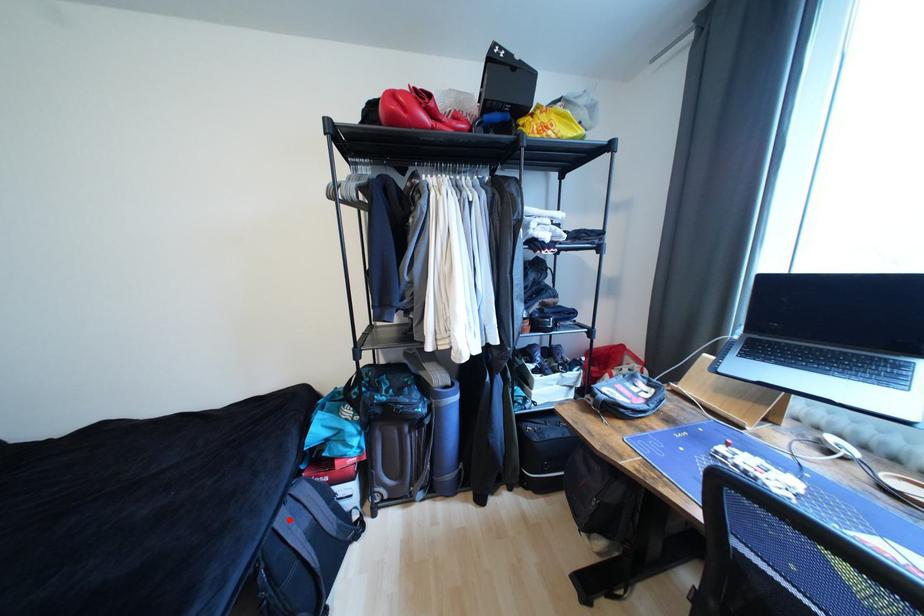
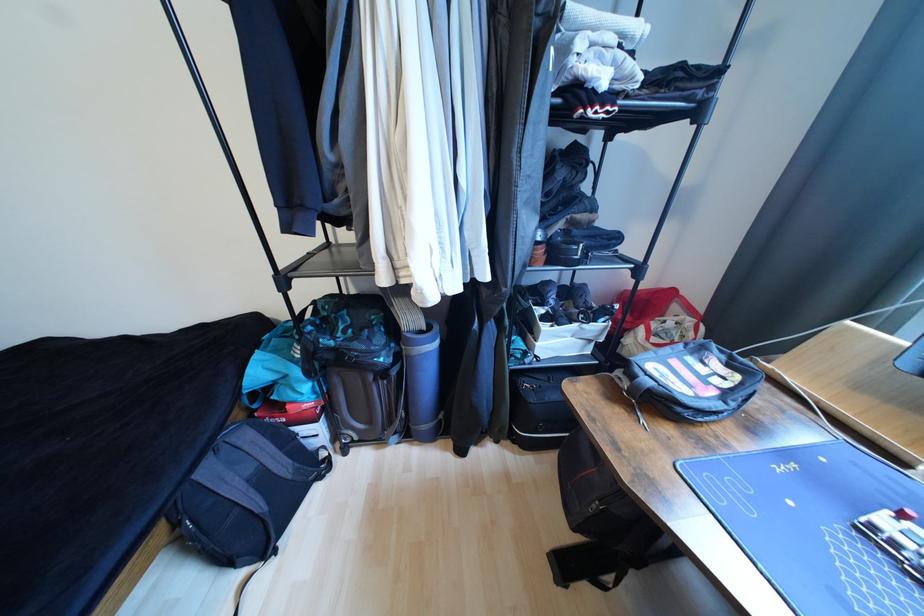
In the second image, find the point that corresponds to the highlighted location in the first image.

(215, 472)